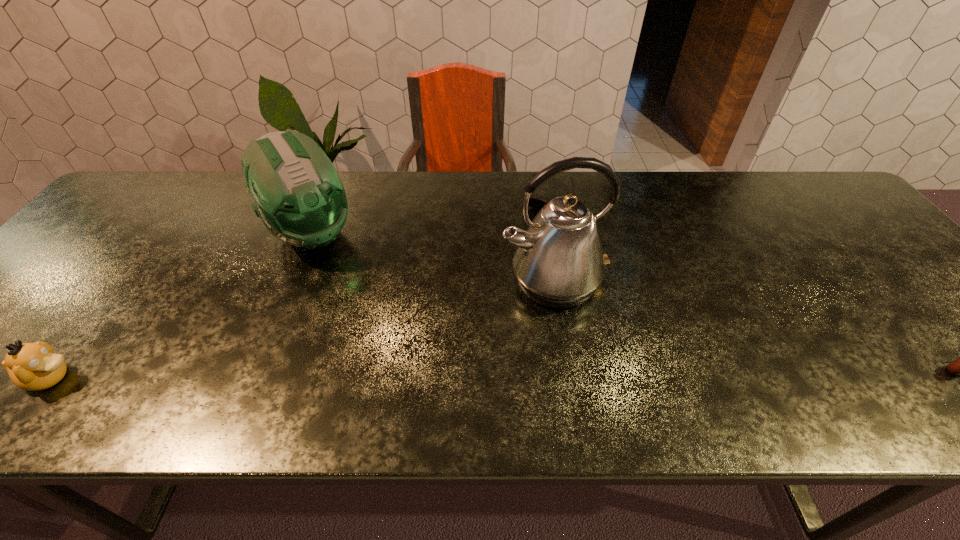
Select which object appears as the second closest to the second tallest object. Please provide its 2D coordinates. Your answer should be formatted as a tuple, i.e. [(x, y)], where the tuple contains the x and y coordinates of a point satisfying the conditions above.

[(559, 263)]

This screenshot has height=540, width=960. I want to click on object that is the third closest to the second object from left to right, so click(x=537, y=203).

The height and width of the screenshot is (540, 960). What are the coordinates of `free location that satisfies the following two spatial constraints: 1. on the back side of the third shortest object; 2. on the right side of the shortest object` in the screenshot? It's located at (326, 197).